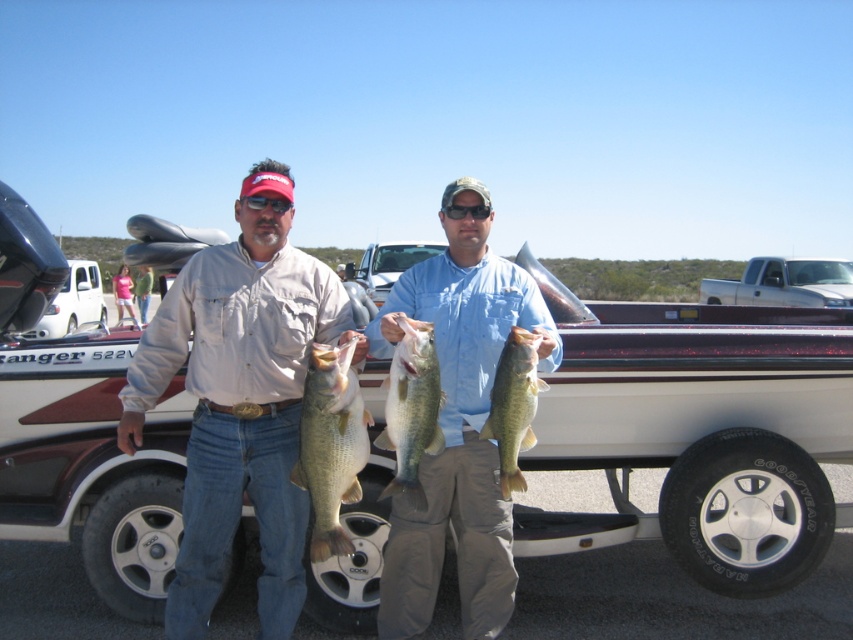
Question: Which point is farther to the camera?

Choices:
 (A) (144, 365)
 (B) (500, 486)

Answer: (A)

Question: Which point is closer to the camera taking this photo?

Choices:
 (A) (x=125, y=460)
 (B) (x=500, y=362)
 (C) (x=467, y=416)

Answer: (B)

Question: Does matte khaki shirt at center appear on the right side of matte pink shirt at center?

Choices:
 (A) no
 (B) yes

Answer: (B)

Question: Among these points, which one is nearest to the camera?

Choices:
 (A) (439, 392)
 (B) (512, 426)

Answer: (A)

Question: In this image, where is white plastic boat at center located relative to green shiny fish at center?

Choices:
 (A) left
 (B) right

Answer: (B)

Question: Is greenish-yellow scales at center below shiny metallic fish at center?

Choices:
 (A) no
 (B) yes

Answer: (B)